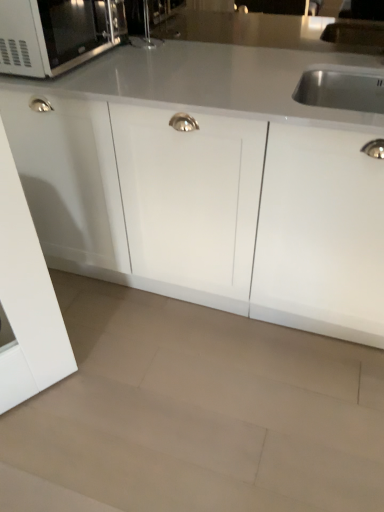
Question: Should I look upward or downward to see white glossy cabinet at center?

Choices:
 (A) down
 (B) up

Answer: (B)

Question: From the image's perspective, is beige polished granite at lower center located beneath matte black microwave at upper left?

Choices:
 (A) no
 (B) yes

Answer: (B)

Question: From a real-world perspective, is beige polished granite at lower center located higher than matte black microwave at upper left?

Choices:
 (A) no
 (B) yes

Answer: (A)

Question: Is the depth of beige polished granite at lower center greater than that of matte black microwave at upper left?

Choices:
 (A) no
 (B) yes

Answer: (A)

Question: Can you confirm if beige polished granite at lower center is taller than matte black microwave at upper left?

Choices:
 (A) yes
 (B) no

Answer: (B)

Question: Is beige polished granite at lower center shorter than matte black microwave at upper left?

Choices:
 (A) no
 (B) yes

Answer: (B)

Question: From the image's perspective, is beige polished granite at lower center over matte black microwave at upper left?

Choices:
 (A) yes
 (B) no

Answer: (B)

Question: Is white glossy cabinet at center positioned in front of matte black microwave at upper left?

Choices:
 (A) yes
 (B) no

Answer: (A)

Question: Is white glossy cabinet at center facing away from matte black microwave at upper left?

Choices:
 (A) no
 (B) yes

Answer: (A)

Question: Is white glossy cabinet at center shorter than matte black microwave at upper left?

Choices:
 (A) yes
 (B) no

Answer: (B)

Question: Is white glossy cabinet at center far away from matte black microwave at upper left?

Choices:
 (A) yes
 (B) no

Answer: (B)

Question: Can you confirm if white glossy cabinet at center is thinner than matte black microwave at upper left?

Choices:
 (A) yes
 (B) no

Answer: (B)

Question: Is matte black microwave at upper left located within white glossy cabinet at center?

Choices:
 (A) yes
 (B) no

Answer: (B)

Question: Does matte black microwave at upper left have a lesser height compared to white glossy cabinet at center?

Choices:
 (A) yes
 (B) no

Answer: (A)